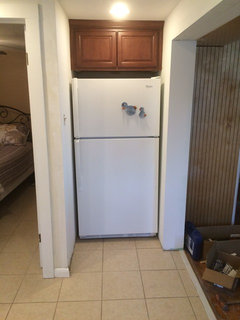
Find the location of `tile`. tile is located at coordinates (128, 280).